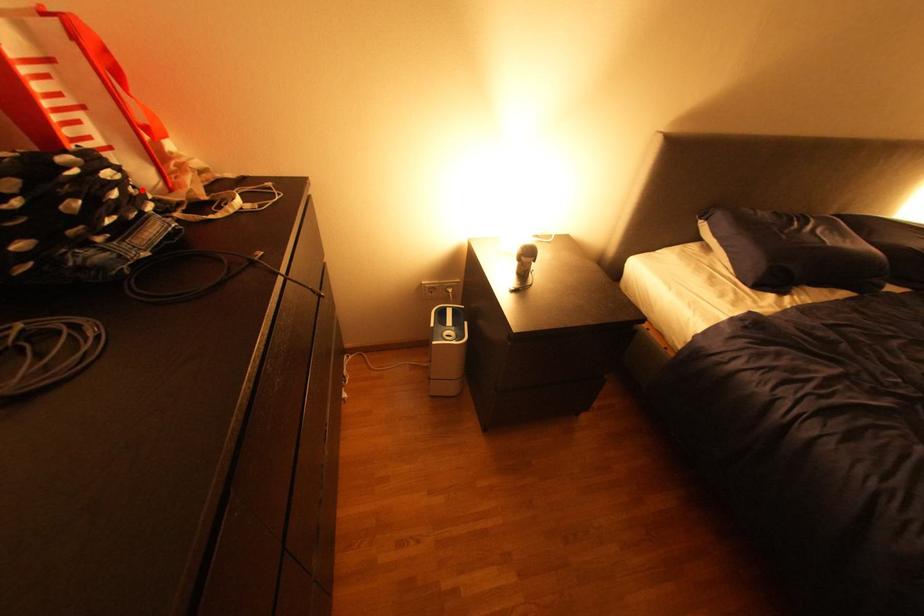
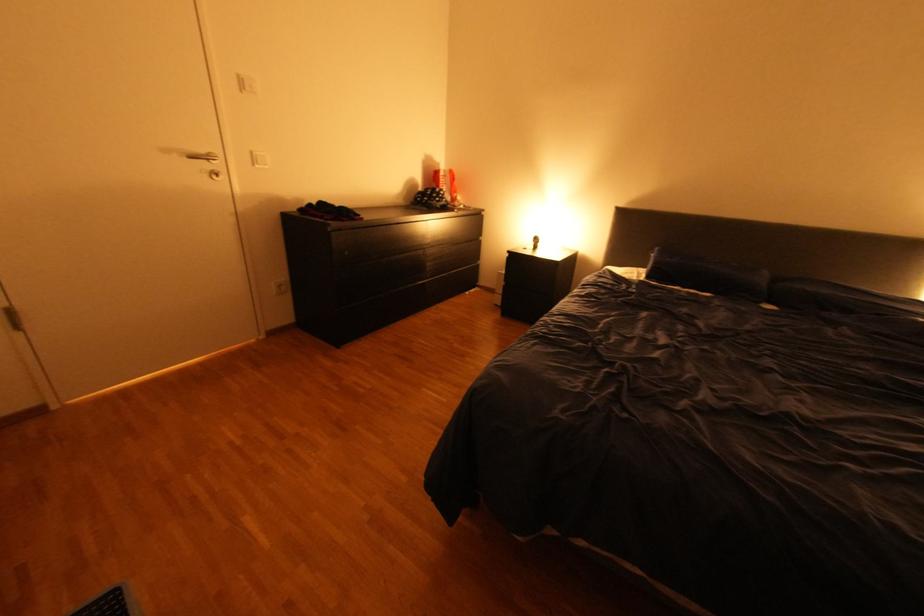
The point at the highlighted location is marked in the first image. Where is the corresponding point in the second image?

(454, 196)